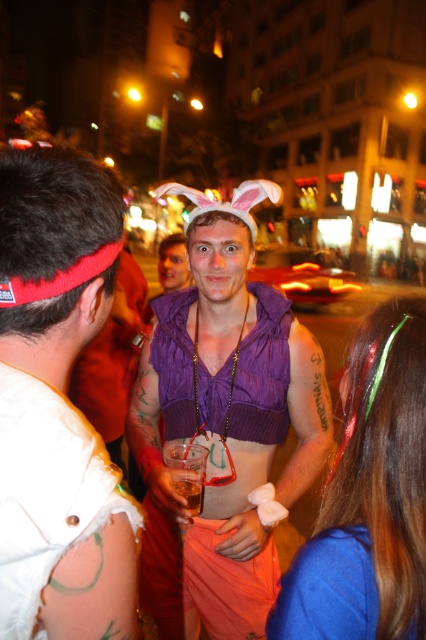
From the picture: Which is above, purple knitted vest at center or blue fabric at lower right?

purple knitted vest at center is higher up.

This screenshot has height=640, width=426. Describe the element at coordinates (224, 422) in the screenshot. I see `purple knitted vest at center` at that location.

Describe the element at coordinates (224, 422) in the screenshot. This screenshot has height=640, width=426. I see `purple knitted vest at center` at that location.

You are a GUI agent. You are given a task and a screenshot of the screen. Output one action in this format:
    pyautogui.click(x=<x>, y=<y>)
    Task: Click on the purple knitted vest at center
    
    Given the screenshot: What is the action you would take?
    coord(224,422)

Is shiny blue hairband at center wider than translucent plastic cup at center?

Yes.

Is point (402, 634) positioned after point (192, 509)?

No, it is in front of (192, 509).

At what (x,y) coordinates should I click in order to perform the action: click on shiny blue hairband at center. Please return your answer as a coordinate pair (x, y). Looking at the image, I should click on (370, 497).

Which is in front, point (244, 246) or point (408, 333)?

Point (408, 333) is more forward.

Does purple knitted vest at center appear over shiny blue hairband at center?

No, purple knitted vest at center is not above shiny blue hairband at center.

I want to click on purple knitted vest at center, so click(224, 422).

Locate an element on the screen. The height and width of the screenshot is (640, 426). purple knitted vest at center is located at coordinates (224, 422).